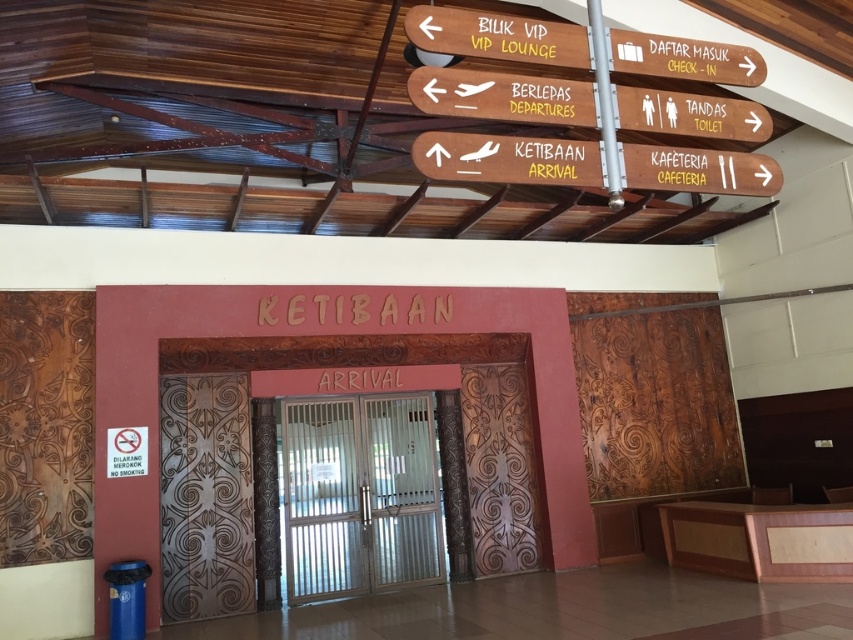
Question: Can you confirm if white metal elevator at center is positioned above white plastic sign at center?

Choices:
 (A) no
 (B) yes

Answer: (A)

Question: Does white plastic sign at center appear under wooden sign at center?

Choices:
 (A) no
 (B) yes

Answer: (B)

Question: Is white plastic sign at center smaller than silver metallic pole at upper center?

Choices:
 (A) yes
 (B) no

Answer: (B)

Question: Which object is farther from the camera taking this photo?

Choices:
 (A) white metal elevator at center
 (B) yellow painted wooden sign at upper center

Answer: (A)

Question: Estimate the real-world distances between objects in this image. Which object is closer to the yellow painted wooden sign at upper center?

Choices:
 (A) wooden sign at center
 (B) silver metallic pole at upper center

Answer: (A)

Question: Which point is farther to the camera?

Choices:
 (A) (691, 38)
 (B) (614, 132)

Answer: (A)